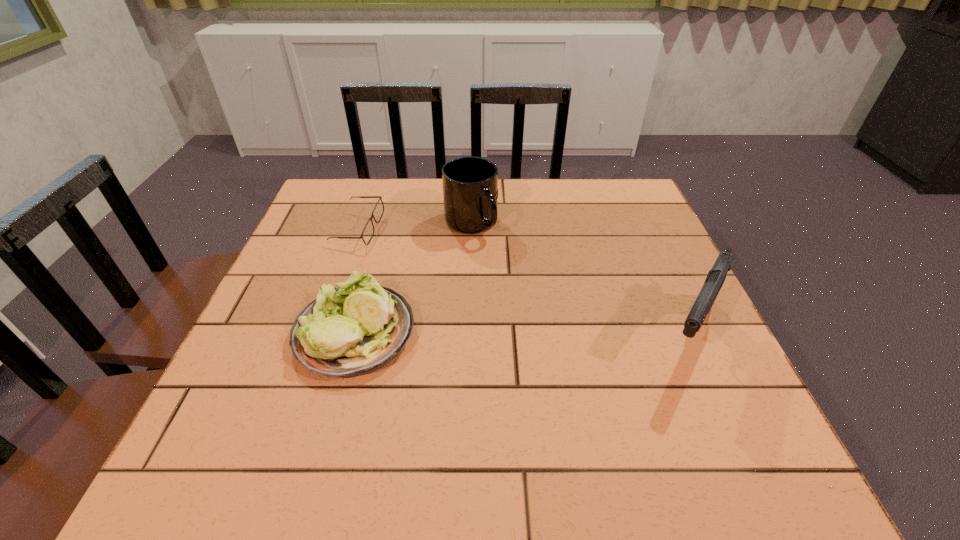
I want to click on object that is at the near left corner, so click(353, 330).

The height and width of the screenshot is (540, 960). Find the location of `object present at the near right corner`. object present at the near right corner is located at coordinates (716, 276).

Image resolution: width=960 pixels, height=540 pixels. Find the location of `free space at the far edge of the desktop`. free space at the far edge of the desktop is located at coordinates (516, 208).

What are the coordinates of `vacant space at the near edge of the desktop` in the screenshot? It's located at (632, 393).

In the image, there is a desktop. In order to click on vacant space at the left edge in this screenshot , I will do `click(332, 249)`.

In the image, there is a desktop. Identify the location of vacant space at the right edge. This screenshot has height=540, width=960. (661, 256).

Find the location of a particular element. The height and width of the screenshot is (540, 960). vacant region at the far left corner of the desktop is located at coordinates (334, 190).

Locate an element on the screen. This screenshot has height=540, width=960. free location at the far right corner is located at coordinates (622, 183).

Where is `free point at the near right corner`? free point at the near right corner is located at coordinates (689, 401).

Identify the location of unoccupied area between the second object from right to left and the spectacles. (415, 226).